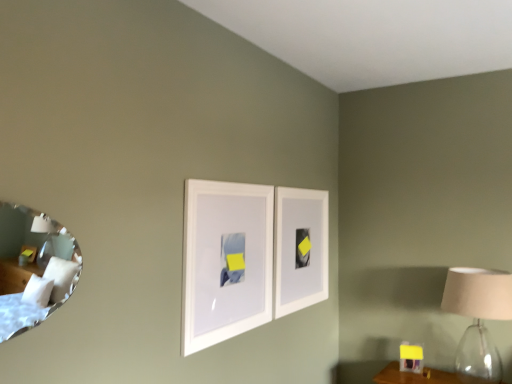
Question: Is white matte picture frame at center, marked as the first picture frame in a left-to-right arrangement, aimed at silver reflective mirror at left?

Choices:
 (A) no
 (B) yes

Answer: (A)

Question: Is white matte picture frame at center, which appears as the second picture frame when viewed from the back, placed right next to silver reflective mirror at left?

Choices:
 (A) yes
 (B) no

Answer: (B)

Question: From a real-world perspective, is white matte picture frame at center, which appears as the second picture frame when viewed from the back, over silver reflective mirror at left?

Choices:
 (A) yes
 (B) no

Answer: (B)

Question: From a real-world perspective, does white matte picture frame at center, marked as the first picture frame in a left-to-right arrangement, sit lower than silver reflective mirror at left?

Choices:
 (A) no
 (B) yes

Answer: (B)

Question: Is white matte picture frame at center, which is counted as the 2th picture frame, starting from the right, closer to camera compared to silver reflective mirror at left?

Choices:
 (A) yes
 (B) no

Answer: (B)

Question: Is white matte picture frame at center, marked as the first picture frame in a left-to-right arrangement, further to the viewer compared to silver reflective mirror at left?

Choices:
 (A) no
 (B) yes

Answer: (B)

Question: Can you confirm if white matte picture frame at center, the 2th picture frame in the left-to-right sequence, is positioned to the left of silver reflective mirror at left?

Choices:
 (A) no
 (B) yes

Answer: (A)

Question: From the image's perspective, would you say white matte picture frame at center, the 1th picture frame from the back, is shown under silver reflective mirror at left?

Choices:
 (A) yes
 (B) no

Answer: (A)

Question: Can you confirm if white matte picture frame at center, the 2th picture frame in the left-to-right sequence, is positioned to the right of silver reflective mirror at left?

Choices:
 (A) yes
 (B) no

Answer: (A)

Question: From a real-world perspective, is white matte picture frame at center, acting as the second picture frame starting from the front, located beneath silver reflective mirror at left?

Choices:
 (A) no
 (B) yes

Answer: (B)

Question: Is white matte picture frame at center, acting as the first picture frame starting from the right, further to camera compared to silver reflective mirror at left?

Choices:
 (A) yes
 (B) no

Answer: (A)

Question: Is white matte picture frame at center, the 1th picture frame from the back, outside of silver reflective mirror at left?

Choices:
 (A) yes
 (B) no

Answer: (A)

Question: Is the position of white matte picture frame at center, marked as the first picture frame in a left-to-right arrangement, more distant than that of white matte picture frame at center, the 2th picture frame in the left-to-right sequence?

Choices:
 (A) no
 (B) yes

Answer: (A)